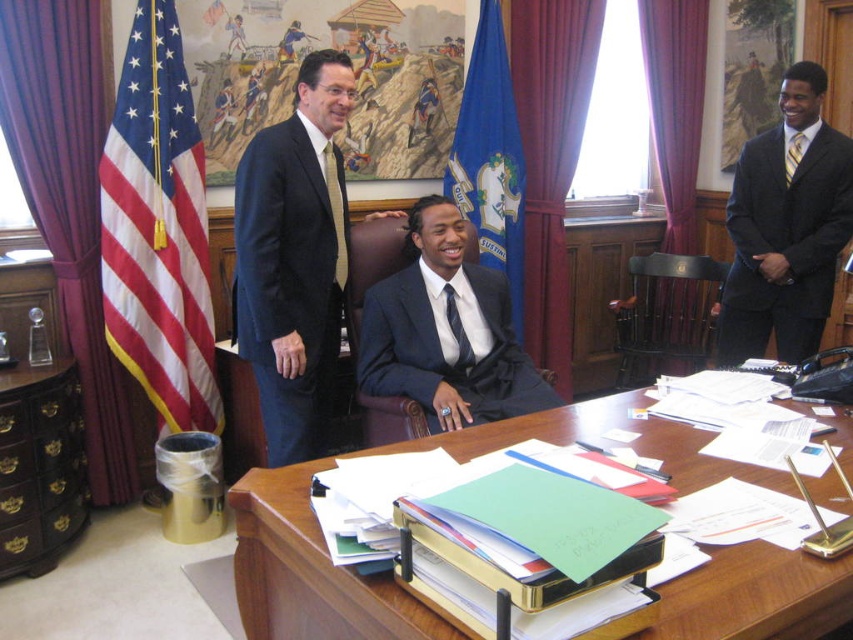
You are a photographer setting up for a group photo in the office. You want to ensure that the matte black suit at right and the blue fabric flag at center are both clearly visible in the frame. Based on their positions, which object is closer to the camera?

The matte black suit at right is in front of the blue fabric flag at center, so it is closer to the camera.